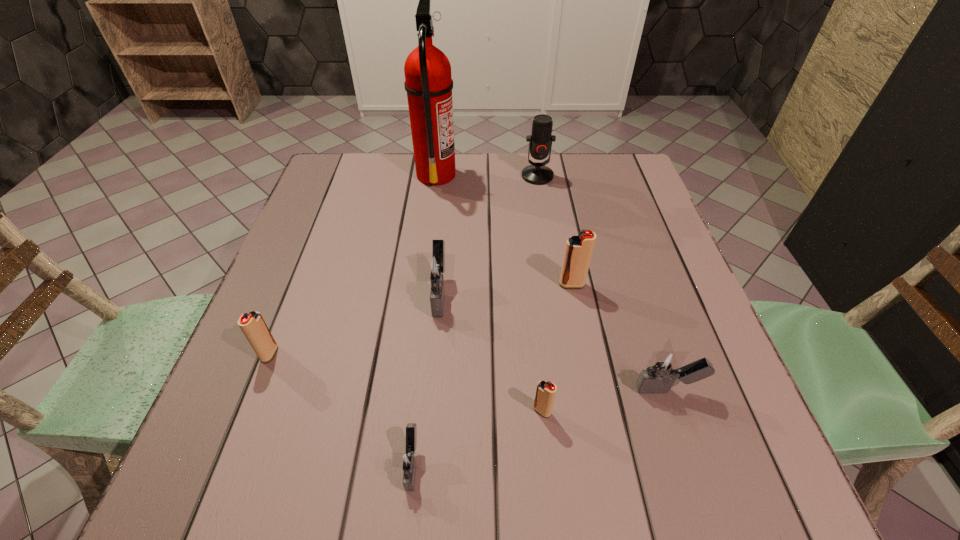
Locate an element on the screen. This screenshot has height=540, width=960. fire extinguisher is located at coordinates (428, 82).

Locate an element on the screen. This screenshot has width=960, height=540. red microphone is located at coordinates (540, 141).

Locate an element on the screen. Image resolution: width=960 pixels, height=540 pixels. the second igniter from right to left is located at coordinates (578, 252).

You are a GUI agent. You are given a task and a screenshot of the screen. Output one action in this format:
    pyautogui.click(x=<x>, y=<y>)
    Task: Click on the rightmost red igniter
    This screenshot has width=960, height=540.
    Given the screenshot: What is the action you would take?
    click(x=578, y=252)

At what (x,y) coordinates should I click in order to perform the action: click on the biggest gray igniter. Please return your answer as a coordinate pair (x, y). This screenshot has width=960, height=540. Looking at the image, I should click on (437, 267).

In order to click on the rightmost igniter in this screenshot , I will do `click(664, 367)`.

Locate an element on the screen. The height and width of the screenshot is (540, 960). the second farthest gray igniter is located at coordinates click(664, 367).

Locate an element on the screen. The height and width of the screenshot is (540, 960). the leftmost red igniter is located at coordinates (253, 326).

Locate an element on the screen. the leftmost object is located at coordinates 253,326.

You are a GUI agent. You are given a task and a screenshot of the screen. Output one action in this format:
    pyautogui.click(x=<x>, y=<y>)
    Task: Click on the second red igniter from right to left
    This screenshot has width=960, height=540.
    Given the screenshot: What is the action you would take?
    pyautogui.click(x=545, y=394)